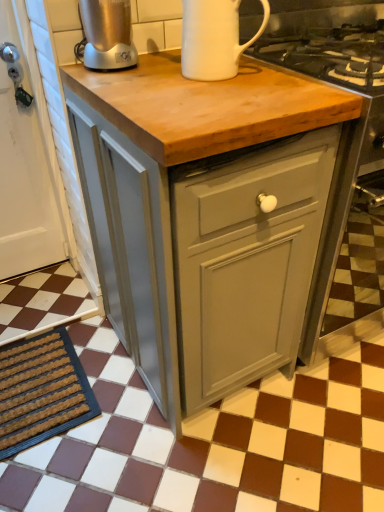
Find the location of `free space to the left of white ceramic mug at upper center, the 2th kitchen appliance when ordered from left to right`. free space to the left of white ceramic mug at upper center, the 2th kitchen appliance when ordered from left to right is located at coordinates (138, 71).